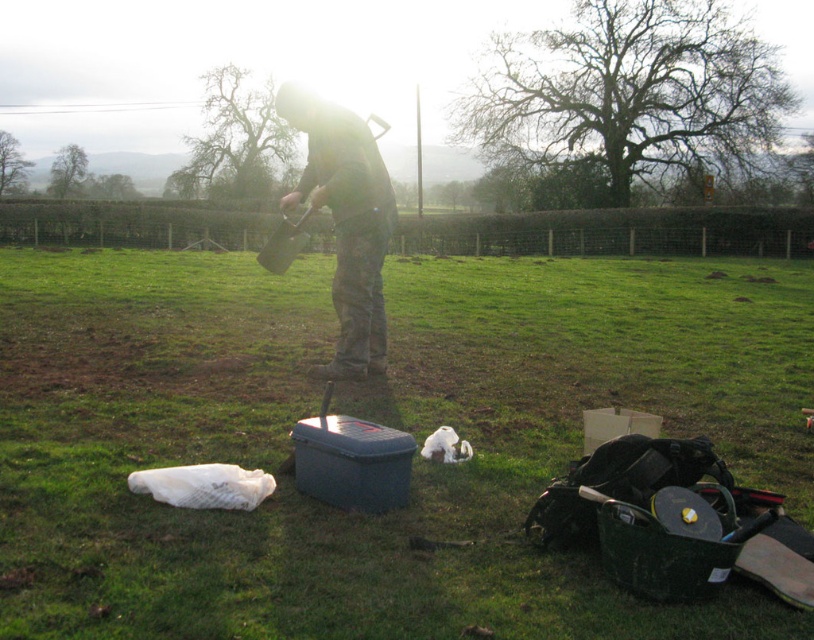
Consider the image. You are a hiker who needs to pack your backpack. You have a matte black tool box at center and a camouflage fabric shirt at center. Which item should you choose if you want the wider one to carry more items?

The matte black tool box at center is wider than the camouflage fabric shirt at center, so you should choose the matte black tool box at center to carry more items.

In the scene shown: You are a hiker who just arrived at the scene and need to locate your items. According to the image, where is the matte black tool box at center in relation to the camouflage fabric shirt at center?

The matte black tool box at center is positioned on the right side of camouflage fabric shirt at center.